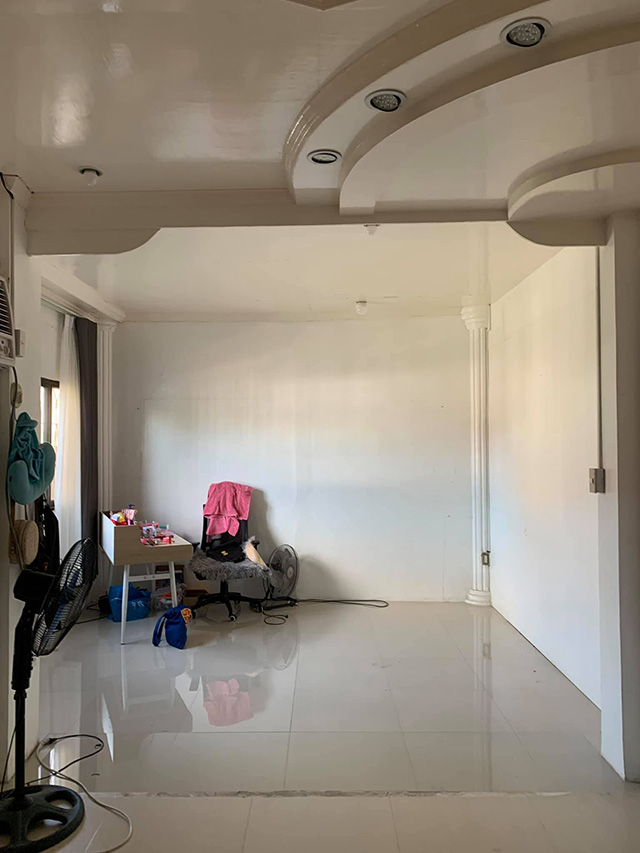
This screenshot has height=853, width=640. What are the coordinates of `lightbulbs` in the screenshot? It's located at (89, 177), (371, 233), (361, 305).